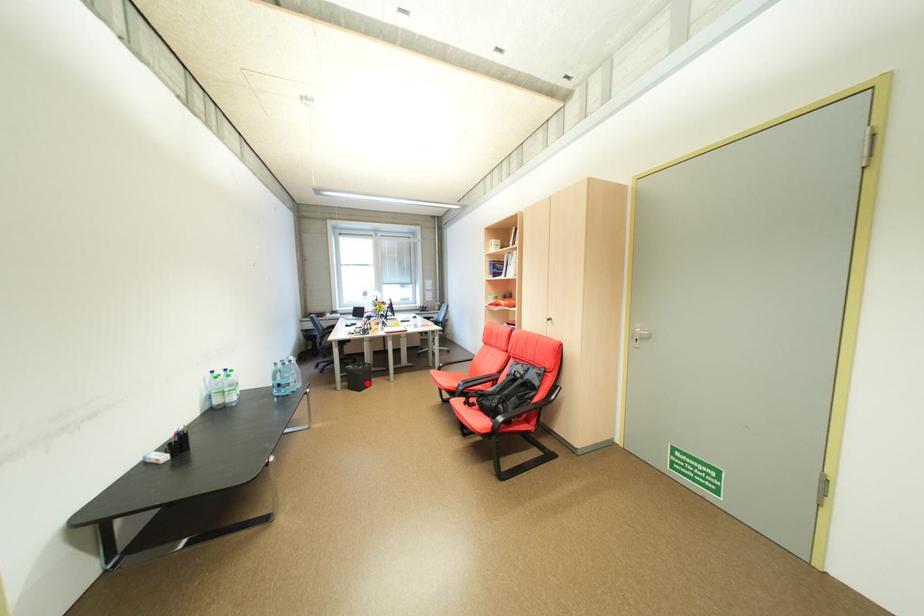
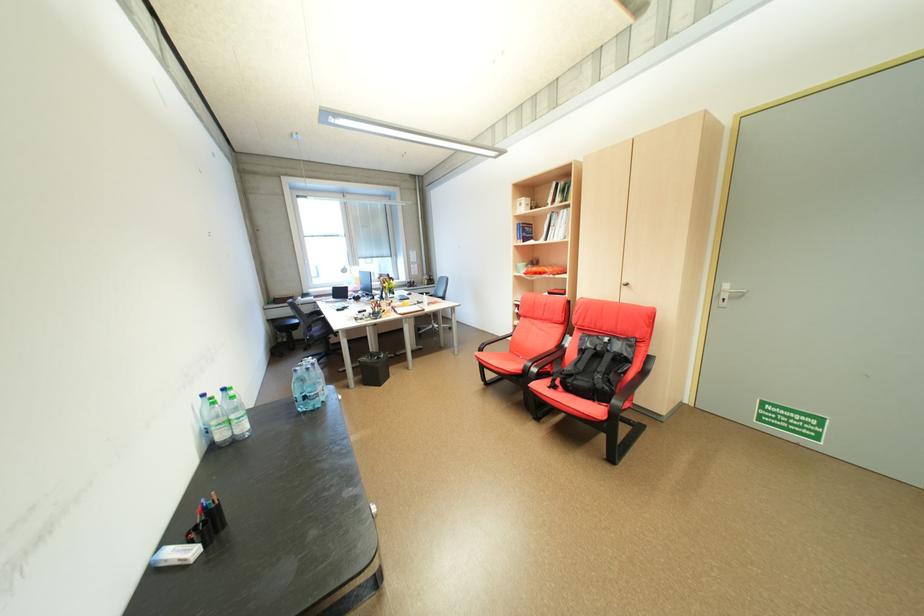
Question: I am providing you with two images of the same scene from different viewpoints. A red point is marked on the first image. Is the red point's position out of view in image 2?

Choices:
 (A) Yes
 (B) No

Answer: (B)